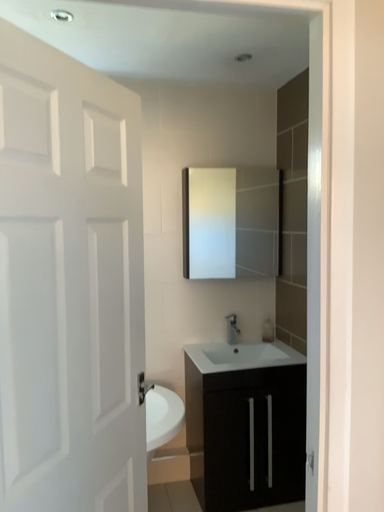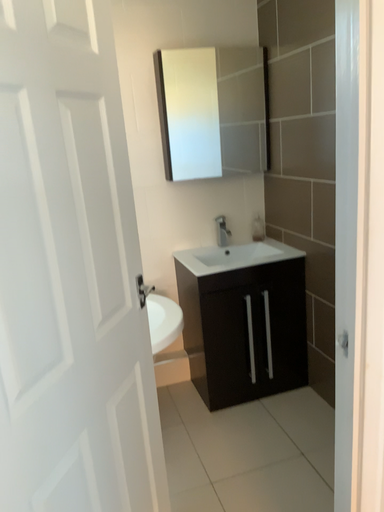
Question: How did the camera likely rotate when shooting the video?

Choices:
 (A) rotated upward
 (B) rotated downward

Answer: (B)